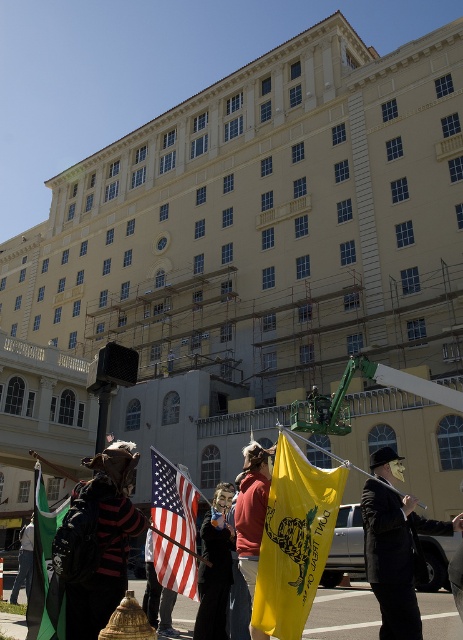
You are a photographer trying to capture a clear shot of both the yellow fabric flag at center and the green fabric flag at lower left. Can you see both flags fully without any obstruction from other objects in the scene?

The green fabric flag at lower left is behind the yellow fabric flag at center, so the photographer cannot see both flags fully without obstruction from the yellow fabric flag at center.

You are a photographer trying to capture the protest scene. You notice the yellow fabric flag at center and the green fabric flag at lower left. Which flag should you focus on if you want to photograph the wider flag?

The green fabric flag at lower left is wider than the yellow fabric flag at center, so you should focus on the green fabric flag at lower left to photograph the wider one.